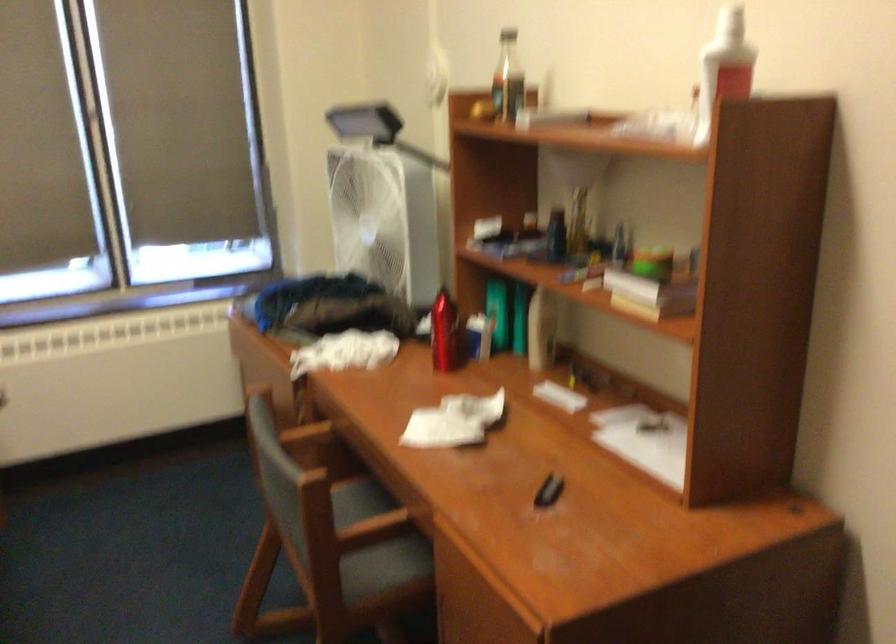
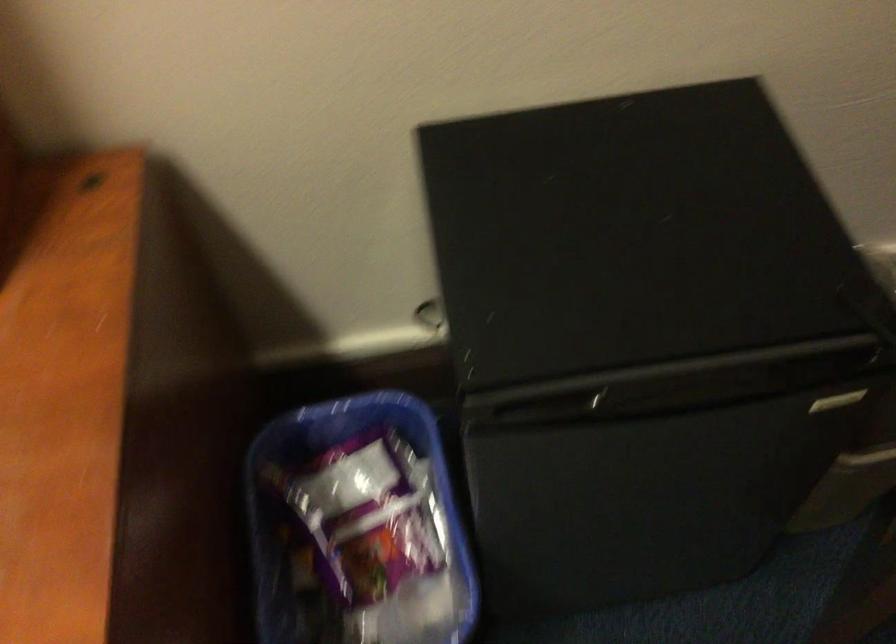
How did the camera likely rotate?

The rotation direction of the camera is right-down.